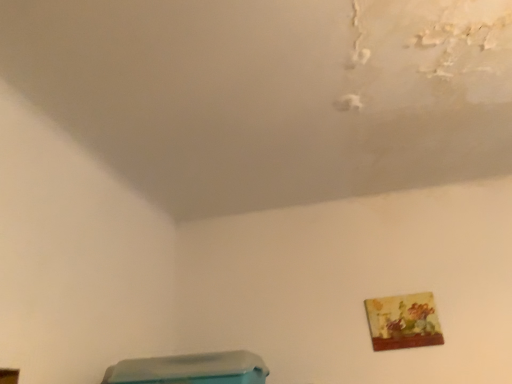
Find the location of a particular element. This screenshot has height=384, width=512. matte floral painting at right is located at coordinates (403, 321).

Describe the element at coordinates (403, 321) in the screenshot. I see `matte floral painting at right` at that location.

Locate an element on the screen. The height and width of the screenshot is (384, 512). matte floral painting at right is located at coordinates (403, 321).